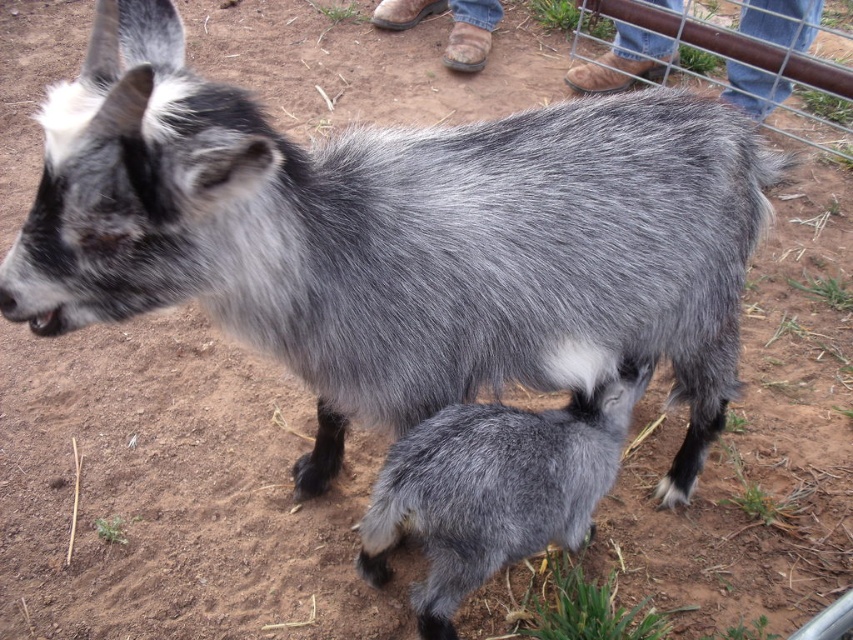
Question: Can you confirm if gray woolen goat at lower center is positioned to the right of metal wire fence at upper right?

Choices:
 (A) no
 (B) yes

Answer: (A)

Question: Does gray woolen goat at lower center have a larger size compared to metal wire fence at upper right?

Choices:
 (A) yes
 (B) no

Answer: (B)

Question: Considering the relative positions of gray woolen goat at lower center and metal wire fence at upper right in the image provided, where is gray woolen goat at lower center located with respect to metal wire fence at upper right?

Choices:
 (A) below
 (B) above

Answer: (A)

Question: Which point is farther to the camera?

Choices:
 (A) (848, 52)
 (B) (393, 481)

Answer: (A)